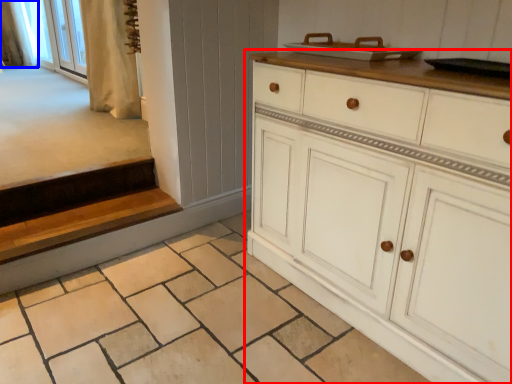
Question: Which object appears farthest to the camera in this image, chest of drawers (highlighted by a red box) or curtain (highlighted by a blue box)?

Choices:
 (A) chest of drawers
 (B) curtain

Answer: (B)